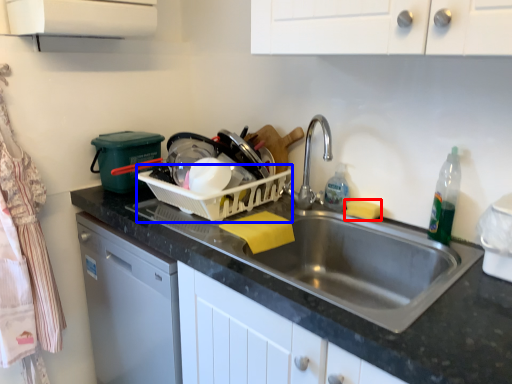
Question: Which object is further to the camera taking this photo, food (highlighted by a red box) or basket (highlighted by a blue box)?

Choices:
 (A) food
 (B) basket

Answer: (A)